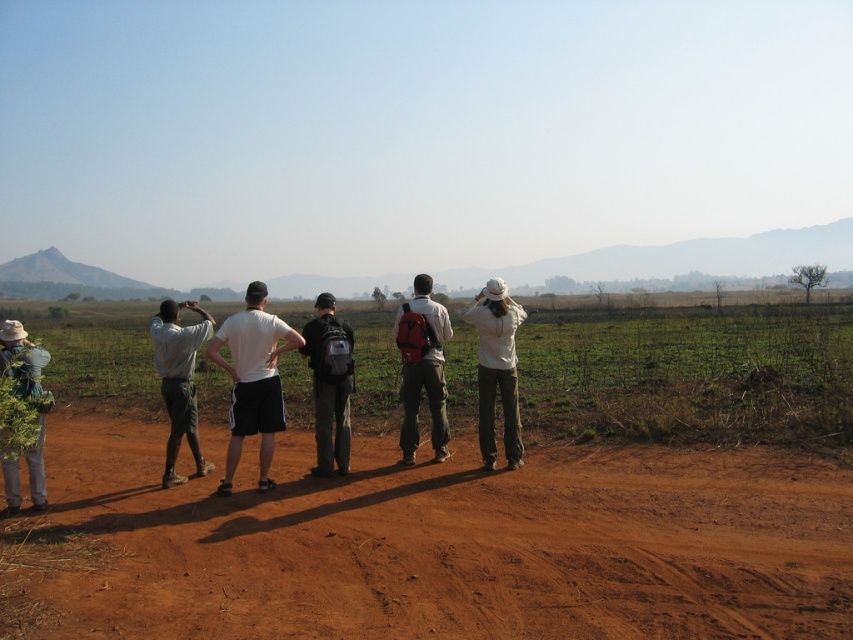
You are standing at the point labeled as point (184, 428) and want to walk towards the point labeled as point (189, 516). Which direction should you face to move directly towards your destination?

You should face forward because point (189, 516) is in front of point (184, 428).

You are a photographer trying to capture a landscape photo that includes both the dirt at center and the matte white shirt at left. Which object should you focus on first to ensure both are in frame?

Since the dirt at center occupies less space than the matte white shirt at left, you should focus on the dirt at center first to ensure it is fully captured in the frame.